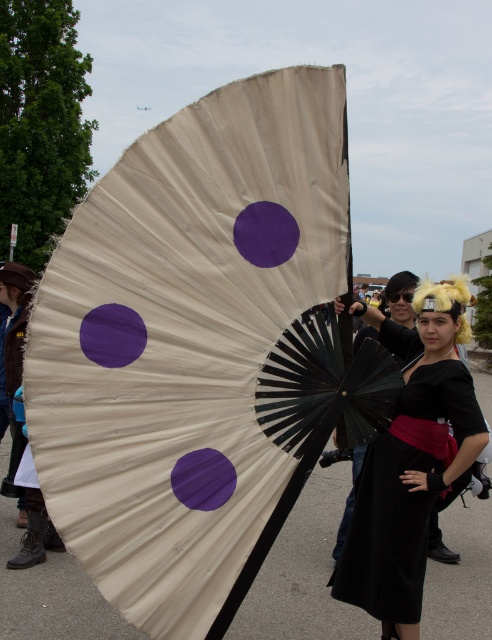
Question: Is black velvet dress at center further to camera compared to purple paper at center?

Choices:
 (A) yes
 (B) no

Answer: (A)

Question: Is purple matte circle at center to the right of purple paper at center from the viewer's perspective?

Choices:
 (A) no
 (B) yes

Answer: (B)

Question: Which point is closer to the camera?

Choices:
 (A) purple paper at center
 (B) black velvet dress at center

Answer: (A)

Question: Which point is closer to the camera taking this photo?

Choices:
 (A) (192, 451)
 (B) (338, 573)
 (C) (275, 211)

Answer: (A)

Question: Which object appears closest to the camera in this image?

Choices:
 (A) purple paper at center
 (B) black velvet dress at center

Answer: (A)

Question: Is black velvet dress at center thinner than purple matte circle at center?

Choices:
 (A) yes
 (B) no

Answer: (B)